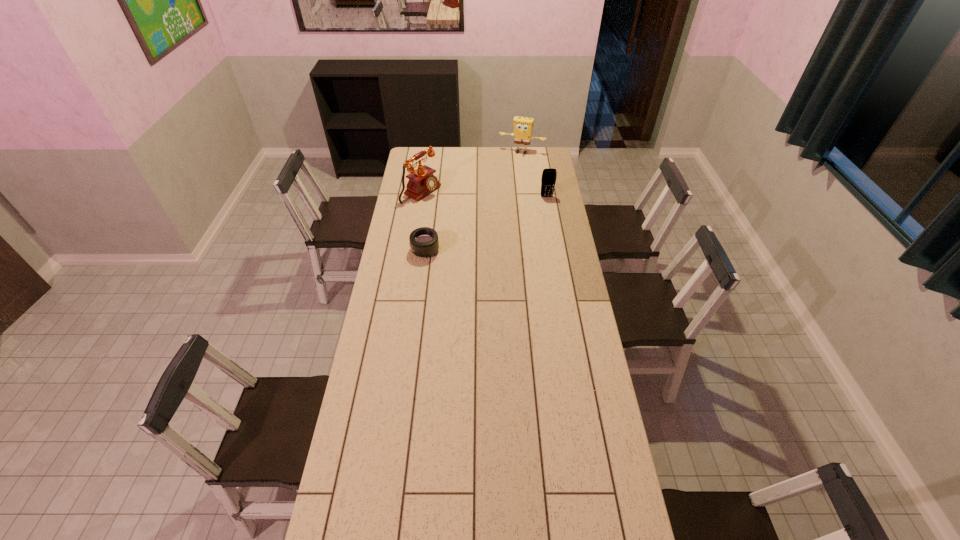
Find the location of `free spot between the telephone and the sponge`. free spot between the telephone and the sponge is located at coordinates (471, 172).

Image resolution: width=960 pixels, height=540 pixels. What are the coordinates of `free space that is in between the third tallest object and the farthest object` in the screenshot? It's located at (534, 174).

Find the location of a particular element. This screenshot has width=960, height=540. free point between the cellular telephone and the telephoto lens is located at coordinates (486, 224).

At what (x,y) coordinates should I click in order to perform the action: click on blank region between the shortest object and the telephone. Please return your answer as a coordinate pair (x, y). Looking at the image, I should click on (423, 221).

The width and height of the screenshot is (960, 540). Find the location of `object that can be found as the second closest to the farthest object`. object that can be found as the second closest to the farthest object is located at coordinates (421, 182).

Select which object is the third closest to the telephone. Please provide its 2D coordinates. Your answer should be formatted as a tuple, i.e. [(x, y)], where the tuple contains the x and y coordinates of a point satisfying the conditions above.

[(548, 180)]

Where is `vacant area that satisfies the following two spatial constraints: 1. on the front side of the shortest object; 2. on the side of the telephone with brand markings and control switches`? This screenshot has height=540, width=960. vacant area that satisfies the following two spatial constraints: 1. on the front side of the shortest object; 2. on the side of the telephone with brand markings and control switches is located at coordinates (412, 250).